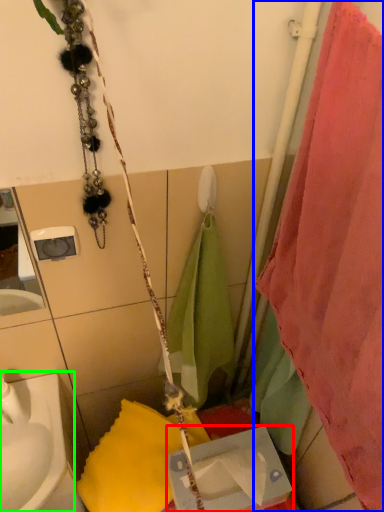
Question: Estimate the real-world distances between objects in this image. Which object is closer to box (highlighted by a red box), curtain (highlighted by a blue box) or sink (highlighted by a green box)?

Choices:
 (A) curtain
 (B) sink

Answer: (B)